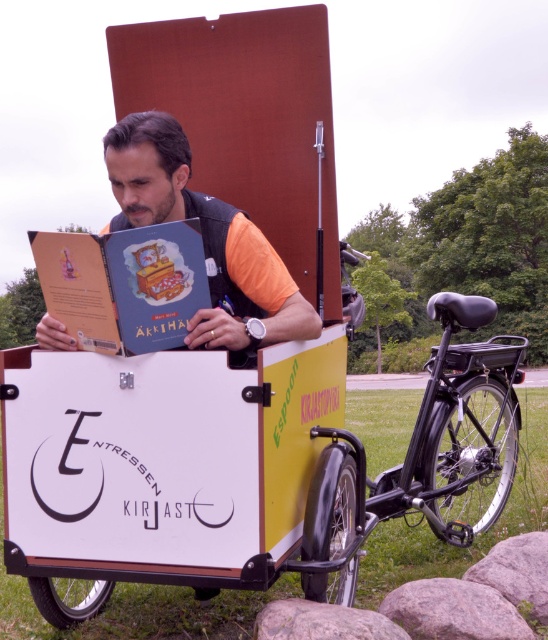
Question: Which point is closer to the camera taking this photo?

Choices:
 (A) (408, 444)
 (B) (233, 241)

Answer: (B)

Question: Which object appears farthest from the camera in this image?

Choices:
 (A) matte black book at center
 (B) hardcover book at center

Answer: (A)

Question: Where is matte black book at center located in relation to hardcover book at center in the image?

Choices:
 (A) below
 (B) above

Answer: (B)

Question: Which object is farther from the camera taking this photo?

Choices:
 (A) hardcover book at center
 (B) matte black book at center

Answer: (B)

Question: Does matte black book at center appear on the left side of hardcover book at center?

Choices:
 (A) yes
 (B) no

Answer: (B)

Question: Does matte black book at center have a smaller size compared to hardcover book at center?

Choices:
 (A) yes
 (B) no

Answer: (B)